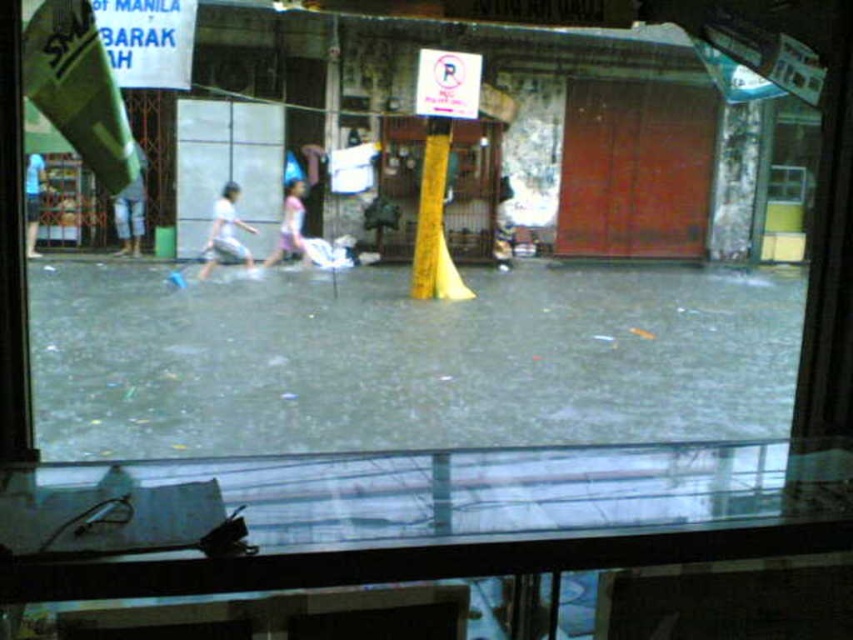
You are looking at a flooded street scene through a glass window. There are two points marked in the image. The first point is at coordinates point (479, 100) and the second is at point (137, 221). Which of these two points is closer to you as you view the scene through the window?

Point (479, 100) is closer to the camera than point (137, 221), so the first point is closer to you.

You are standing in front of the flooded street scene displayed through a glass window. You notice a white paper sign at upper center and white cotton pants at left. Which object is nearer to you?

The white paper sign at upper center is closer to the viewer than the white cotton pants at left.